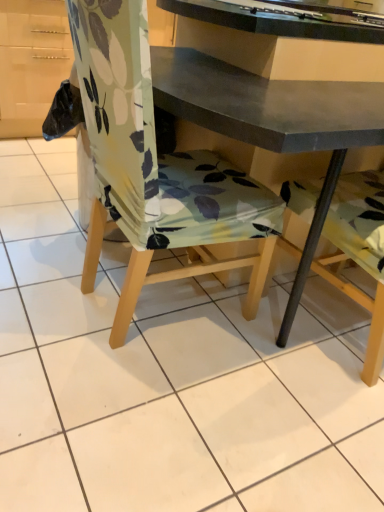
Question: Is floral fabric chair at center outside of matte gray desk at center?

Choices:
 (A) yes
 (B) no

Answer: (A)

Question: Is floral fabric chair at center bigger than matte gray desk at center?

Choices:
 (A) no
 (B) yes

Answer: (B)

Question: From the image's perspective, is floral fabric chair at center below matte gray desk at center?

Choices:
 (A) yes
 (B) no

Answer: (B)

Question: Is floral fabric chair at center far away from matte gray desk at center?

Choices:
 (A) no
 (B) yes

Answer: (A)

Question: Is floral fabric chair at center further to camera compared to matte gray desk at center?

Choices:
 (A) yes
 (B) no

Answer: (B)

Question: From the image's perspective, is floral fabric chair at center on top of matte gray desk at center?

Choices:
 (A) no
 (B) yes

Answer: (B)

Question: Is matte gray desk at center positioned behind floral fabric chair at center?

Choices:
 (A) no
 (B) yes

Answer: (B)

Question: From a real-world perspective, is matte gray desk at center located beneath floral fabric chair at center?

Choices:
 (A) yes
 (B) no

Answer: (B)

Question: Does matte gray desk at center have a lesser height compared to floral fabric chair at center?

Choices:
 (A) no
 (B) yes

Answer: (A)

Question: Is matte gray desk at center not near floral fabric chair at center?

Choices:
 (A) yes
 (B) no

Answer: (B)

Question: Is matte gray desk at center wider than floral fabric chair at center?

Choices:
 (A) no
 (B) yes

Answer: (A)

Question: Is matte gray desk at center facing towards floral fabric chair at center?

Choices:
 (A) yes
 (B) no

Answer: (B)

Question: Does point (220, 135) appear closer or farther from the camera than point (97, 225)?

Choices:
 (A) farther
 (B) closer

Answer: (B)